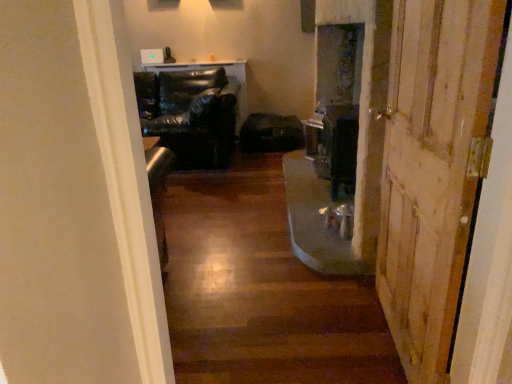
Question: Is black leather chair at center bigger than wooden door at right?

Choices:
 (A) no
 (B) yes

Answer: (B)

Question: Is black leather chair at center with wooden door at right?

Choices:
 (A) yes
 (B) no

Answer: (B)

Question: Is black leather chair at center positioned far away from wooden door at right?

Choices:
 (A) no
 (B) yes

Answer: (B)

Question: Considering the relative positions of black leather chair at center and wooden door at right in the image provided, is black leather chair at center to the left of wooden door at right from the viewer's perspective?

Choices:
 (A) yes
 (B) no

Answer: (A)

Question: Is black leather chair at center facing towards wooden door at right?

Choices:
 (A) yes
 (B) no

Answer: (A)

Question: Considering their positions, is black leather chair at center located in front of or behind wooden floor at center?

Choices:
 (A) front
 (B) behind

Answer: (B)

Question: Considering the positions of black leather chair at center and wooden floor at center in the image, is black leather chair at center taller or shorter than wooden floor at center?

Choices:
 (A) short
 (B) tall

Answer: (B)

Question: From a real-world perspective, is black leather chair at center positioned above or below wooden floor at center?

Choices:
 (A) below
 (B) above

Answer: (B)

Question: Is black leather chair at center wider or thinner than wooden floor at center?

Choices:
 (A) wide
 (B) thin

Answer: (B)

Question: From a real-world perspective, is wooden floor at center positioned above or below wooden door at right?

Choices:
 (A) above
 (B) below

Answer: (B)

Question: Considering the positions of point (291, 317) and point (451, 109), is point (291, 317) closer or farther from the camera than point (451, 109)?

Choices:
 (A) farther
 (B) closer

Answer: (A)

Question: From the image's perspective, is wooden floor at center above or below wooden door at right?

Choices:
 (A) above
 (B) below

Answer: (B)

Question: Which is correct: wooden floor at center is inside wooden door at right, or outside of it?

Choices:
 (A) inside
 (B) outside

Answer: (B)

Question: In the image, is wooden door at right on the left side or the right side of wooden floor at center?

Choices:
 (A) right
 (B) left

Answer: (A)

Question: Is wooden door at right situated inside wooden floor at center or outside?

Choices:
 (A) inside
 (B) outside

Answer: (B)